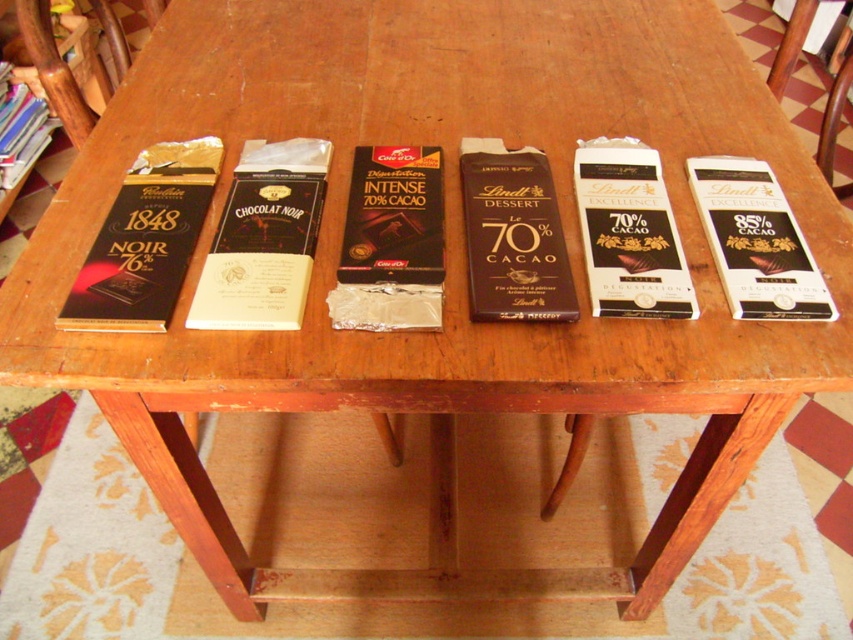
Is point (86, 298) more distant than point (717, 208)?

That is False.

The image size is (853, 640). Describe the element at coordinates (144, 241) in the screenshot. I see `matte black chocolate bar at left` at that location.

This screenshot has height=640, width=853. In order to click on matte black chocolate bar at left in this screenshot , I will do `click(144, 241)`.

Which of these two, dark brown matte chocolate bar at center or white glossy lindt excellence chocolate bar at right, stands shorter?

Standing shorter between the two is white glossy lindt excellence chocolate bar at right.

Is dark brown matte chocolate bar at center bigger than white glossy lindt excellence chocolate bar at right?

Yes.

Is point (467, 204) closer to camera compared to point (799, 237)?

No, (467, 204) is further to viewer.

Where is `dark brown matte chocolate bar at center`? This screenshot has height=640, width=853. dark brown matte chocolate bar at center is located at coordinates (514, 236).

Does point (234, 177) come in front of point (627, 241)?

No.

What do you see at coordinates (264, 240) in the screenshot? The image size is (853, 640). I see `matte white chocolate bar at center` at bounding box center [264, 240].

Who is more forward, (212,326) or (663,273)?

Point (212,326)

This screenshot has width=853, height=640. In order to click on matte white chocolate bar at center in this screenshot , I will do `click(264, 240)`.